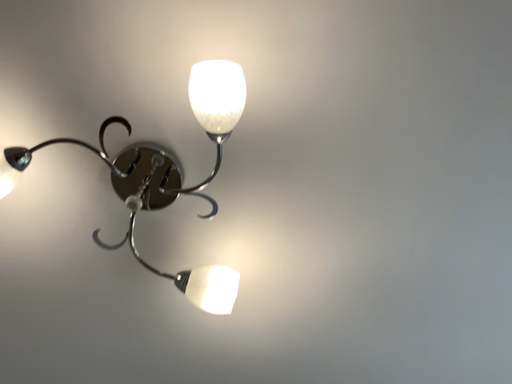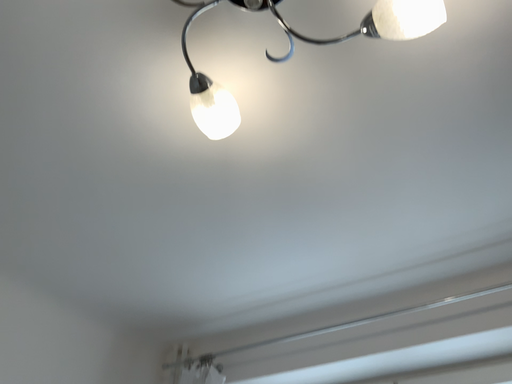
Question: How did the camera likely rotate when shooting the video?

Choices:
 (A) rotated left
 (B) rotated right

Answer: (B)